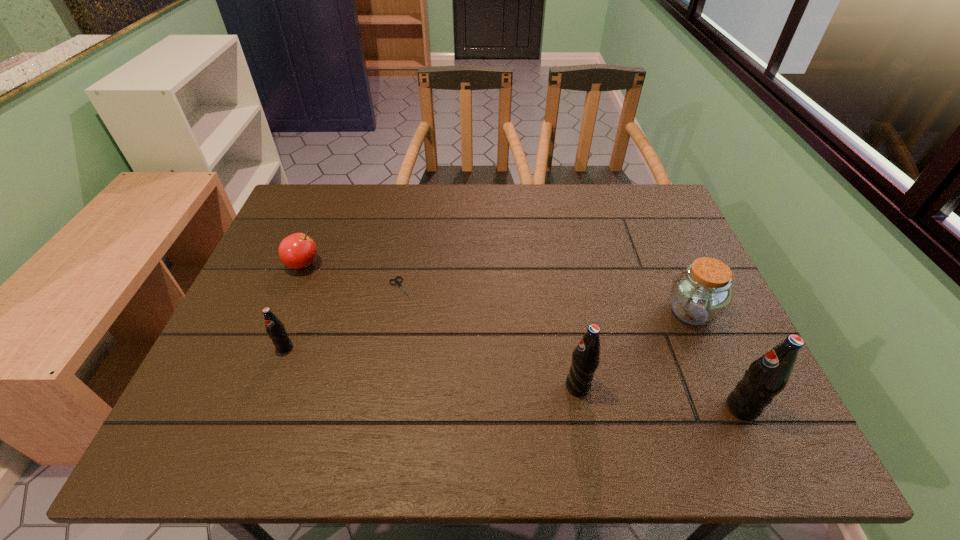
You are a GUI agent. You are given a task and a screenshot of the screen. Output one action in this format:
    pyautogui.click(x=<x>, y=<y>)
    Task: Click on the free spot between the second pop from left to right and the fourth object from right to left
    The height and width of the screenshot is (540, 960).
    Given the screenshot: What is the action you would take?
    pyautogui.click(x=490, y=338)

Locate an element on the screen. The width and height of the screenshot is (960, 540). vacant area between the shortest pop and the second tallest object is located at coordinates (431, 367).

You are a GUI agent. You are given a task and a screenshot of the screen. Output one action in this format:
    pyautogui.click(x=<x>, y=<y>)
    Task: Click on the vacant space in between the jar and the rightmost pop
    The height and width of the screenshot is (540, 960).
    Given the screenshot: What is the action you would take?
    pyautogui.click(x=716, y=360)

You are a GUI agent. You are given a task and a screenshot of the screen. Output one action in this format:
    pyautogui.click(x=<x>, y=<y>)
    Task: Click on the vacant area that lies between the jar and the rightmost pop
    
    Given the screenshot: What is the action you would take?
    pyautogui.click(x=716, y=360)

Locate an element on the screen. The image size is (960, 540). free spot between the jar and the apple is located at coordinates (497, 288).

Locate an element on the screen. This screenshot has height=540, width=960. vacant area that lies between the jar and the fourth object from left to right is located at coordinates (635, 349).

At what (x,y) coordinates should I click in order to perform the action: click on vacant space in between the apple and the shortest pop. Please return your answer as a coordinate pair (x, y). The width and height of the screenshot is (960, 540). Looking at the image, I should click on (294, 306).

Locate an element on the screen. This screenshot has width=960, height=540. vacant area that lies between the shortest pop and the second shortest pop is located at coordinates (431, 367).

Find the location of a particular element. This screenshot has height=540, width=960. vacant space that is in between the second shortest pop and the fourth farthest object is located at coordinates (431, 367).

Locate an element on the screen. The width and height of the screenshot is (960, 540). vacant space in between the leftmost pop and the third object from left to right is located at coordinates (343, 318).